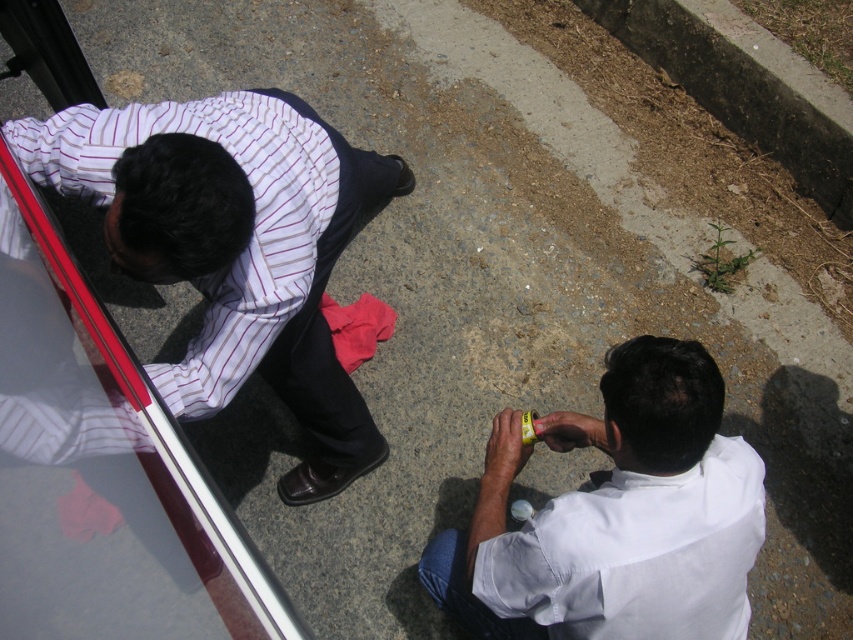
Question: Among these points, which one is nearest to the camera?

Choices:
 (A) (482, 504)
 (B) (296, 339)

Answer: (A)

Question: Does striped cotton shirt at left have a lesser width compared to white matte shirt at lower right?

Choices:
 (A) no
 (B) yes

Answer: (A)

Question: Which object is closer to the camera taking this photo?

Choices:
 (A) white matte shirt at lower right
 (B) striped cotton shirt at left

Answer: (B)

Question: Does striped cotton shirt at left lie behind white matte shirt at lower right?

Choices:
 (A) no
 (B) yes

Answer: (A)

Question: Is striped cotton shirt at left bigger than white matte shirt at lower right?

Choices:
 (A) yes
 (B) no

Answer: (A)